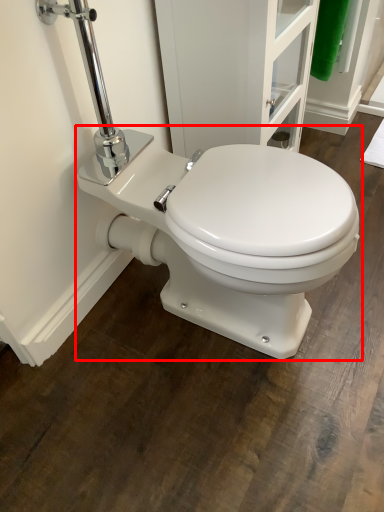
Question: Observing the image, what is the correct spatial positioning of toilet (annotated by the red box) in reference to screen door?

Choices:
 (A) left
 (B) right

Answer: (A)